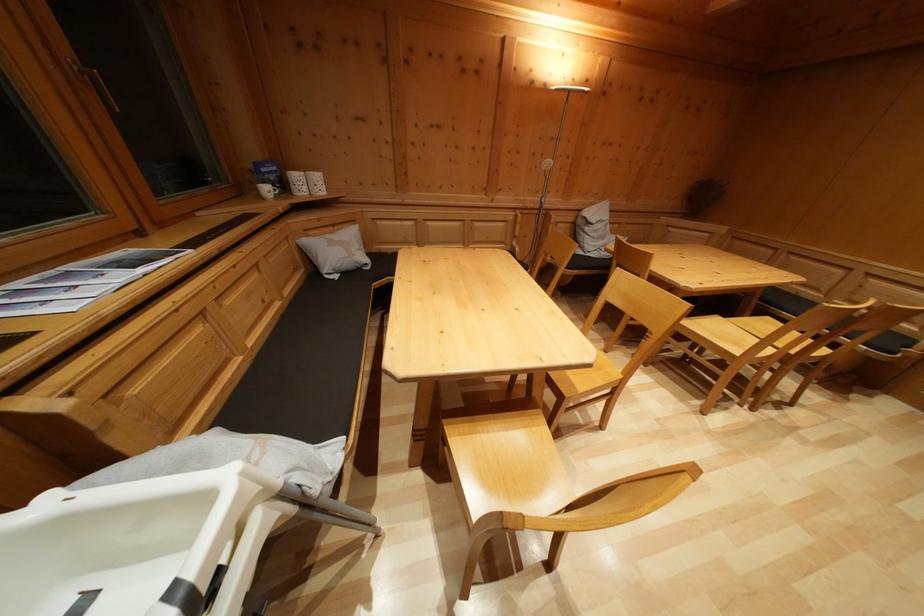
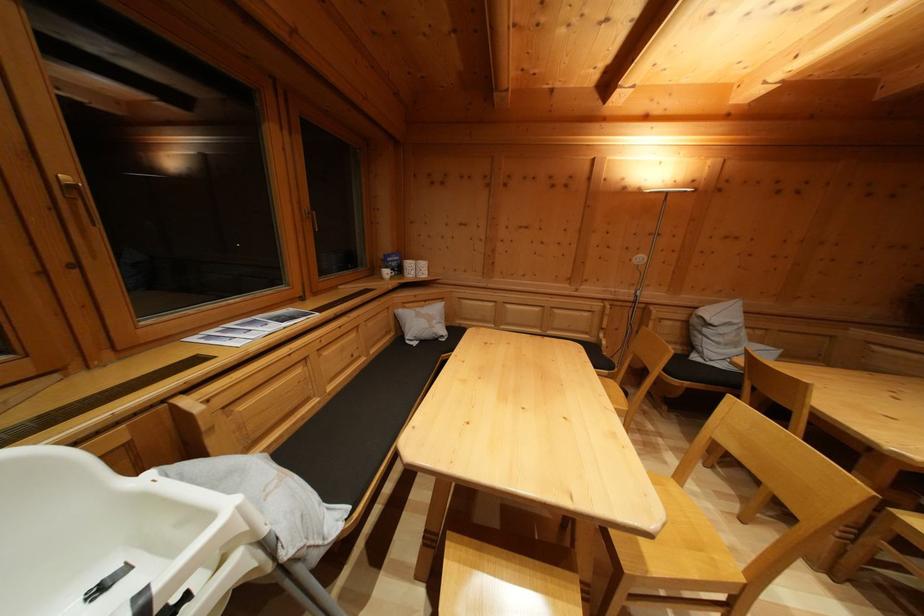
Locate, in the second image, the point that corresponds to (x=274, y=180) in the first image.

(397, 268)